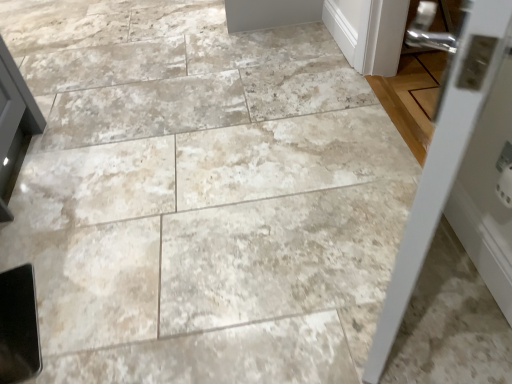
The height and width of the screenshot is (384, 512). What are the coordinates of `free space that is in between white glossy door at right, acting as the first door starting from the bottom, and white painted wood door at upper right, which is counted as the 2th door, starting from the bottom` in the screenshot? It's located at (357, 175).